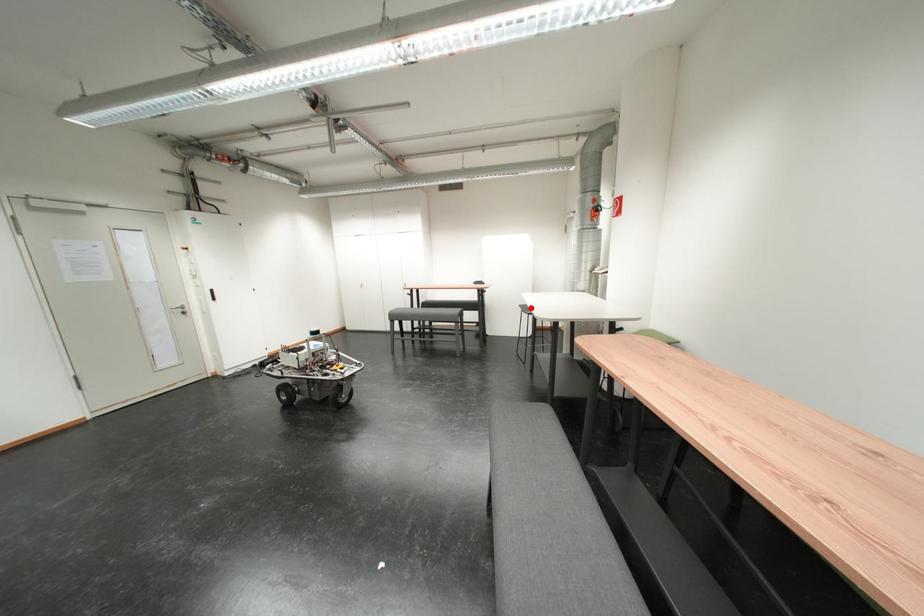
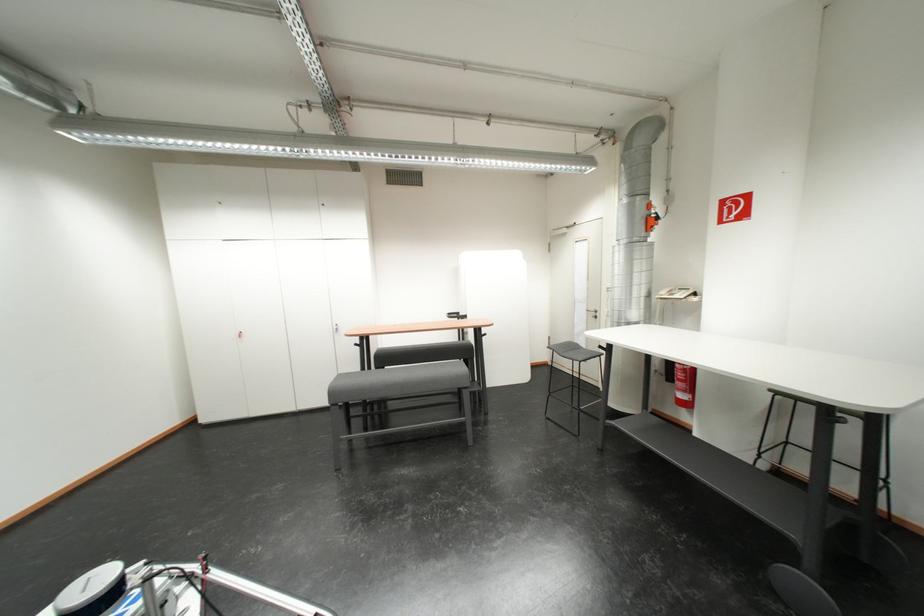
Find the pixel in the second image that matches the highlighted location in the first image.

(560, 350)